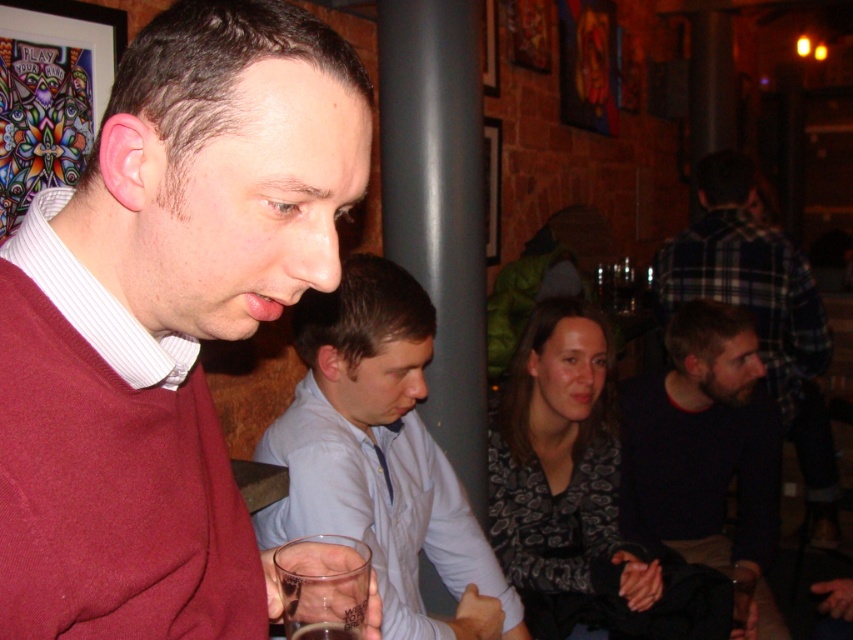
Locate an element on the screen. white shirt at center is located at coordinates (380, 456).

Is white shirt at center wider than transparent plastic cup at lower center?

Indeed, white shirt at center has a greater width compared to transparent plastic cup at lower center.

Which is behind, point (410, 611) or point (288, 545)?

The point (410, 611) is behind.

Where is `white shirt at center`? white shirt at center is located at coordinates (380, 456).

In the scene shown: Does maroon sweater at center have a smaller size compared to translucent glass at lower center?

No, maroon sweater at center is not smaller than translucent glass at lower center.

Is point (67, 348) farther from viewer compared to point (340, 634)?

No, (67, 348) is closer to viewer.

You are a GUI agent. You are given a task and a screenshot of the screen. Output one action in this format:
    pyautogui.click(x=<x>, y=<y>)
    Task: Click on the maroon sweater at center
    This screenshot has width=853, height=640.
    Given the screenshot: What is the action you would take?
    pyautogui.click(x=165, y=321)

Can you confirm if dark blue sweater at right is shorter than translucent glass at lower center?

Incorrect, dark blue sweater at right's height does not fall short of translucent glass at lower center's.

Can you confirm if dark blue sweater at right is positioned to the left of translucent glass at lower center?

In fact, dark blue sweater at right is to the right of translucent glass at lower center.

Between point (820, 520) and point (322, 634), which one is positioned behind?

The point (820, 520) is behind.

The height and width of the screenshot is (640, 853). Find the location of `dark blue sweater at right`. dark blue sweater at right is located at coordinates (759, 312).